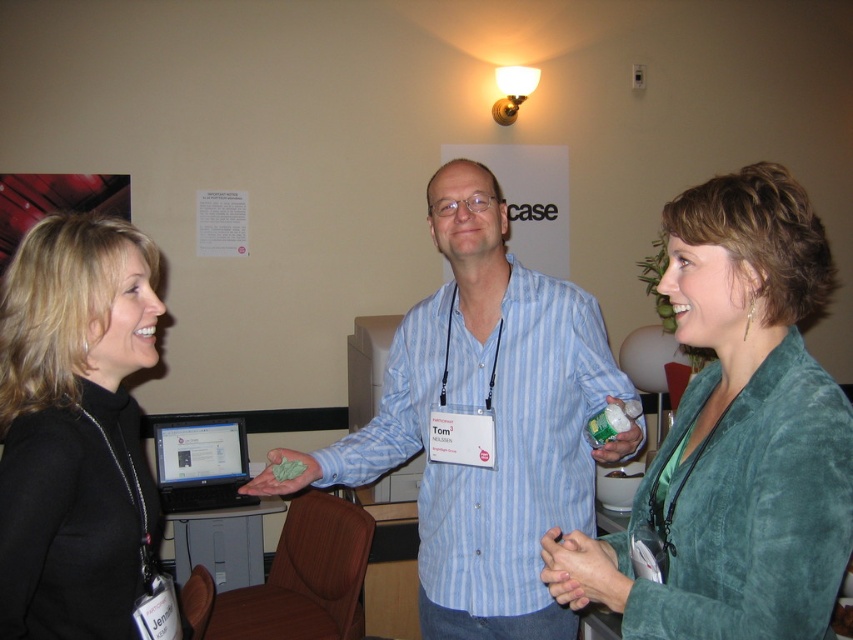
Question: Is velvety green blazer at center bigger than smooth skin hands at center?

Choices:
 (A) yes
 (B) no

Answer: (A)

Question: Estimate the real-world distances between objects in this image. Which object is closer to the velvety green blazer at center?

Choices:
 (A) white matte pill bottle at center
 (B) green matte cloth at center
 (C) blue striped shirt at center
 (D) black matte jacket at left

Answer: (A)

Question: Which object is closer to the camera taking this photo?

Choices:
 (A) black matte jacket at left
 (B) green matte cloth at center
 (C) smooth skin hands at center

Answer: (A)

Question: Does velvety green blazer at center have a greater width compared to blue striped shirt at center?

Choices:
 (A) yes
 (B) no

Answer: (B)

Question: Which object is the closest to the black matte jacket at left?

Choices:
 (A) velvety green blazer at center
 (B) green matte cloth at center
 (C) white matte pill bottle at center
 (D) blue striped shirt at center

Answer: (B)

Question: Can you confirm if velvety green blazer at center is smaller than smooth skin hands at center?

Choices:
 (A) yes
 (B) no

Answer: (B)